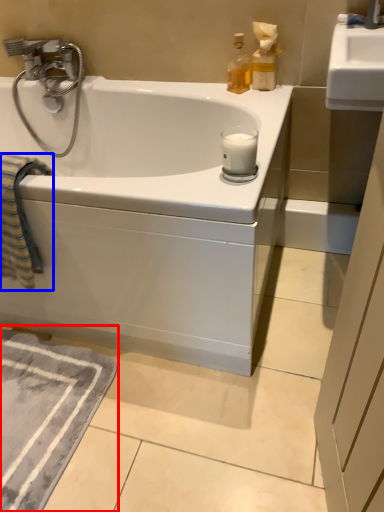
Question: Which of the following is the closest to the observer, bath mat (highlighted by a red box) or beach towel (highlighted by a blue box)?

Choices:
 (A) bath mat
 (B) beach towel

Answer: (B)